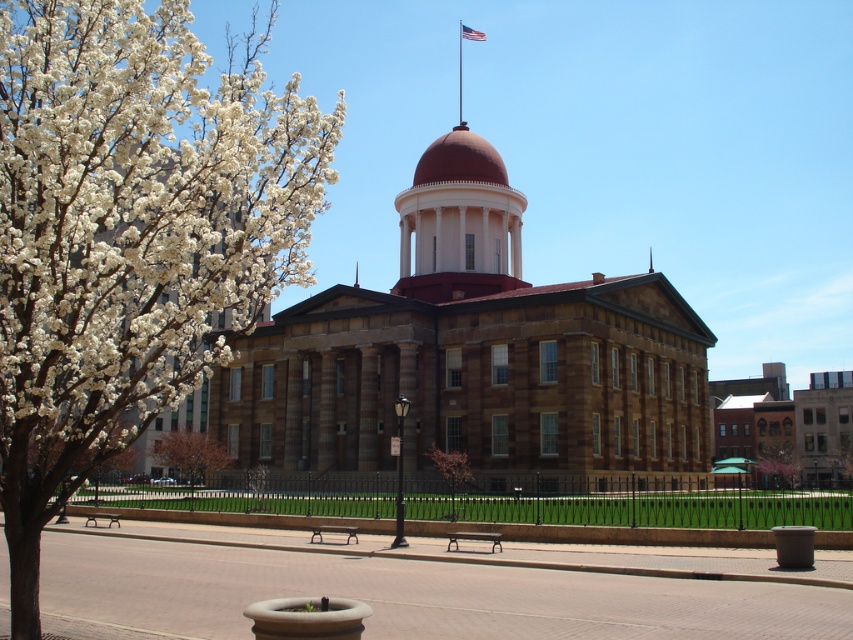
Question: Considering the relative positions of metallic flag pole at upper center and metallic polished bench at center in the image provided, where is metallic flag pole at upper center located with respect to metallic polished bench at center?

Choices:
 (A) above
 (B) below

Answer: (A)

Question: Among these points, which one is farthest from the camera?

Choices:
 (A) (851, 444)
 (B) (111, 515)
 (C) (38, 408)
 (D) (786, 448)

Answer: (A)

Question: Which point is closer to the camera?

Choices:
 (A) (209, 449)
 (B) (485, 536)
 (C) (318, 534)
 (D) (485, 35)

Answer: (B)

Question: Is matte brick dome at center to the left of american flag at upper center from the viewer's perspective?

Choices:
 (A) yes
 (B) no

Answer: (A)

Question: Does white blossoms at left lie behind bare branches at center?

Choices:
 (A) yes
 (B) no

Answer: (B)

Question: Which point appears farthest from the camera in this image?

Choices:
 (A) (781, 460)
 (B) (461, 81)

Answer: (B)